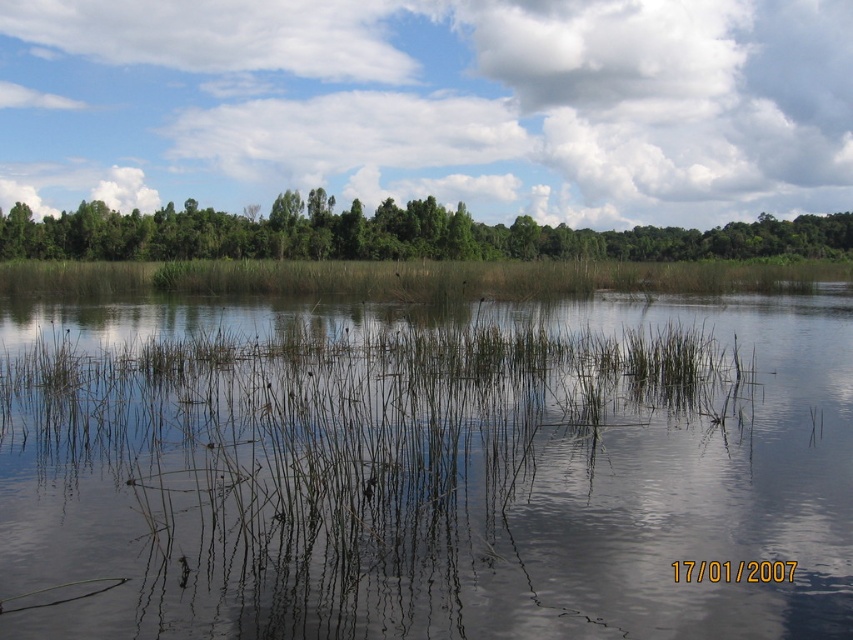
Does translucent water at center lie behind green leafy trees at upper center?

No, translucent water at center is closer to the viewer.

Is translucent water at center above green leafy trees at upper center?

Actually, translucent water at center is below green leafy trees at upper center.

Does point (10, 593) lie behind point (315, 234)?

No.

Where is `translucent water at center`? translucent water at center is located at coordinates (426, 472).

Which is more to the right, translucent water at center or white fluffy cloud at upper center?

white fluffy cloud at upper center

Does point (386, 461) come farther from viewer compared to point (550, 84)?

That is False.

Is point (426, 324) farther from camera compared to point (244, 138)?

That is False.

At what (x,y) coordinates should I click in order to perform the action: click on translucent water at center. Please return your answer as a coordinate pair (x, y). Looking at the image, I should click on (426, 472).

Is point (698, 177) positioned after point (212, 225)?

Yes, it is.

Can you confirm if white fluffy cloud at upper center is positioned to the right of green leafy trees at upper center?

No, white fluffy cloud at upper center is not to the right of green leafy trees at upper center.

Which is in front, point (399, 92) or point (842, 225)?

Point (842, 225)

Find the location of a particular element. This screenshot has width=853, height=640. white fluffy cloud at upper center is located at coordinates (432, 106).